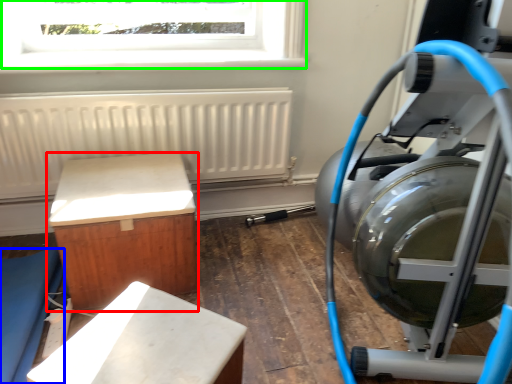
Question: Considering the real-world distances, which object is farthest from furniture (highlighted by a red box)? furniture (highlighted by a blue box) or window (highlighted by a green box)?

Choices:
 (A) furniture
 (B) window

Answer: (B)